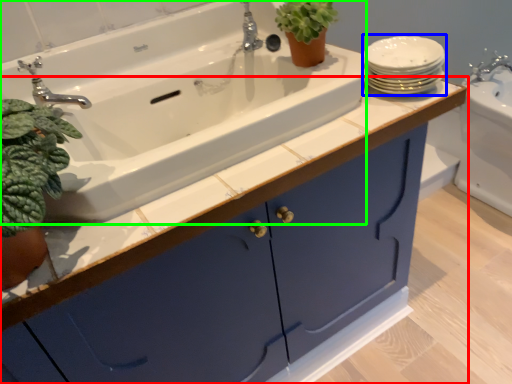
Question: Which object is positioned closest to bathroom cabinet (highlighted by a red box)? Select from tableware (highlighted by a blue box) and sink (highlighted by a green box).

Choices:
 (A) tableware
 (B) sink

Answer: (B)